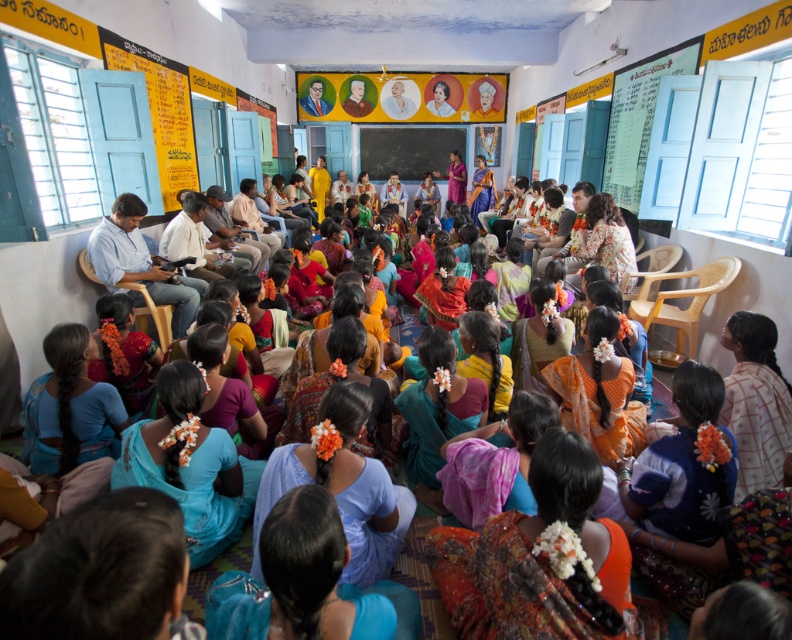
You are a photographer adjusting your camera to focus on two points in the classroom scene. The first point is at coordinates point (101, 256) and the second is at point (429, 164). Which point should you focus on first if you want to capture the closest object to the camera?

Point (101, 256) is closer to the camera than point (429, 164), so you should focus on point (101, 256) first to capture the closest object.

You are a student in the classroom and want to write something on the white paperboard at upper right and the smooth wooden board at center. Which board should you approach first if you want to reach the one closer to you?

You should approach the white paperboard at upper right first because it is closer to the viewer than the smooth wooden board at center.

You are standing in the classroom and want to place a new chart on the wall. The chart requires a space that is exactly at the coordinates given by the white paperboard at upper right. Where should you place the new chart?

You should place the new chart at the coordinates point [638,116] where the white paperboard at upper right is located.